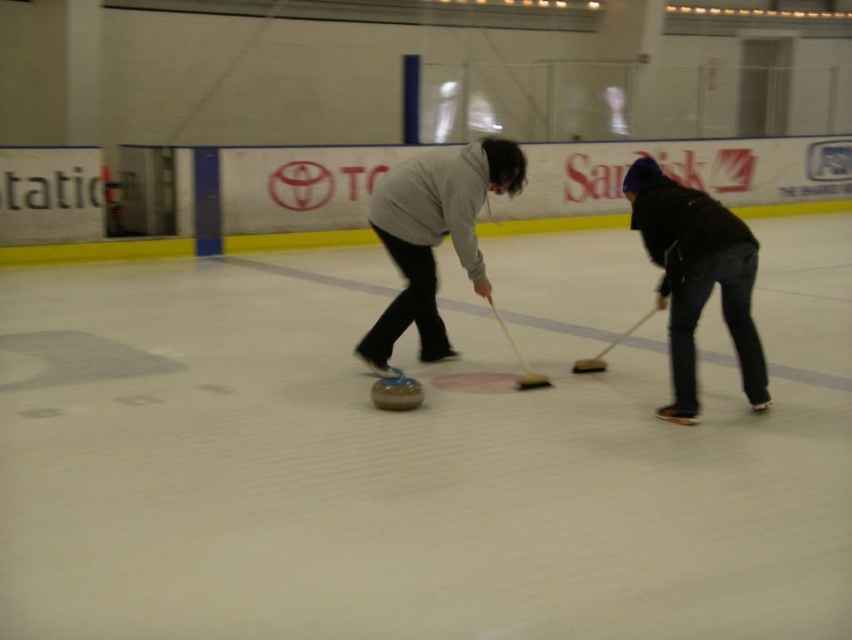
Between brown wooden hockey at center and smooth brown hockey at center, which one is positioned higher?

smooth brown hockey at center

Does point (522, 365) come in front of point (612, 346)?

Yes.

Is point (496, 308) farther from viewer compared to point (632, 326)?

No, (496, 308) is in front of (632, 326).

This screenshot has height=640, width=852. I want to click on brown wooden hockey at center, so click(x=519, y=356).

Who is more forward, (678, 259) or (579, 364)?

Point (678, 259) is more forward.

Does black matte jacket at lower right appear on the right side of smooth brown hockey at center?

Indeed, black matte jacket at lower right is positioned on the right side of smooth brown hockey at center.

Identify the location of black matte jacket at lower right. (695, 276).

Where is `black matte jacket at lower right`? black matte jacket at lower right is located at coordinates (695, 276).

Between matte gray sweater at center and black matte jacket at lower right, which one has more height?

black matte jacket at lower right

Is matte gray sweater at center in front of black matte jacket at lower right?

No, it is not.

Where is `matte gray sweater at center`? matte gray sweater at center is located at coordinates (433, 236).